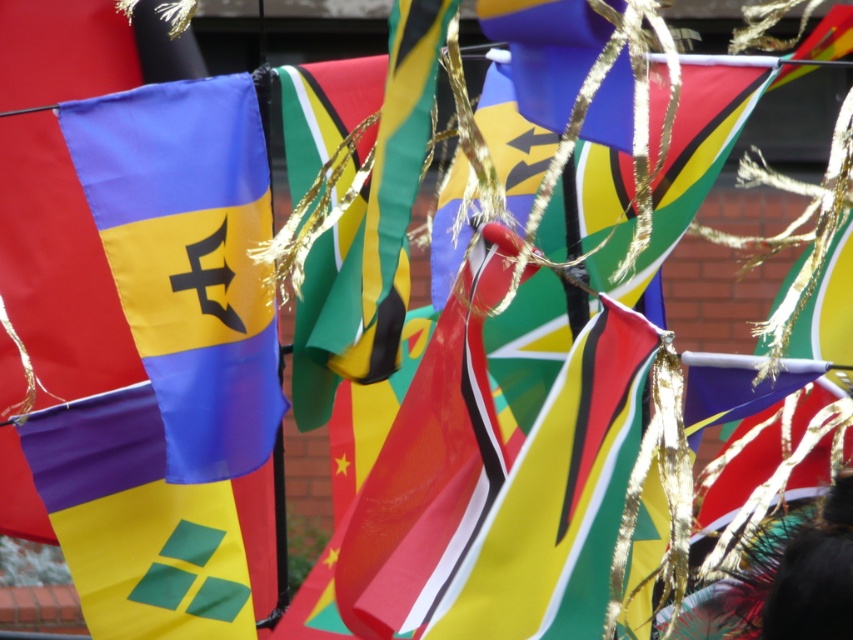
You are organizing a parade and need to arrange the matte blue flag at left and the matte fabric flag at lower left on a banner stand. Which flag should you place first if you want the wider flag to be on the right side?

The matte fabric flag at lower left is wider than the matte blue flag at left. To place the wider flag on the right side, you should first place the matte blue flag at left on the left side and then the matte fabric flag at lower left on the right side.

You are at the center of the flag display and see the matte blue flag at left and the matte fabric flag at lower left. Which flag is positioned more to your right side?

The matte blue flag at left is positioned more to the right side than the matte fabric flag at lower left.